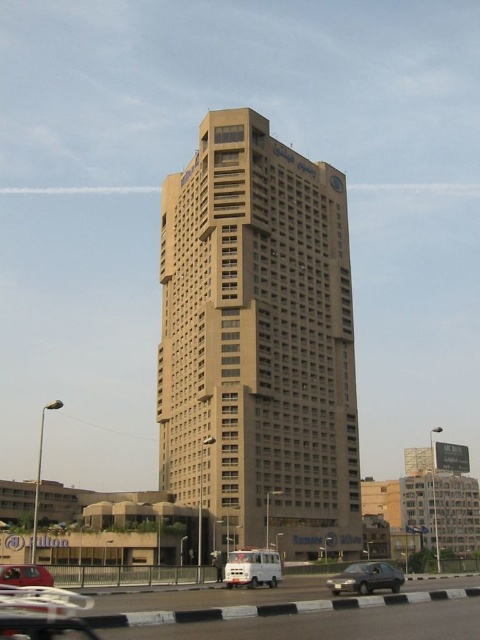
Question: Observing the image, what is the correct spatial positioning of beige concrete building at center in reference to white matte van at center?

Choices:
 (A) below
 (B) above

Answer: (B)

Question: Is beige concrete building at center thinner than dark gray metallic car at lower center?

Choices:
 (A) no
 (B) yes

Answer: (A)

Question: Which point is closer to the camera?

Choices:
 (A) (374, 577)
 (B) (268, 554)
 (C) (154, 616)
 (D) (328, 426)

Answer: (C)

Question: Which point is closer to the camera taking this photo?

Choices:
 (A) (184, 336)
 (B) (238, 576)

Answer: (B)

Question: Considering the relative positions of white matte van at center and matte red car at lower left in the image provided, where is white matte van at center located with respect to matte red car at lower left?

Choices:
 (A) below
 (B) above

Answer: (A)

Question: Which object appears closest to the camera in this image?

Choices:
 (A) black asphalt highway at lower center
 (B) dark gray metallic car at lower center

Answer: (A)